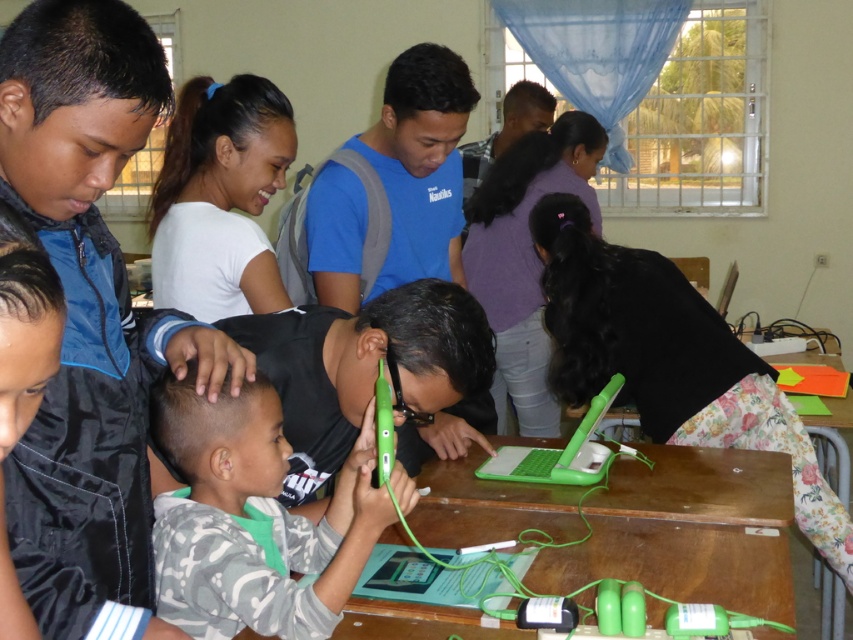
You are a student trying to place both the green matte tablet at center and the green plastic phone at center into your backpack. Which one should you place first to ensure both fit properly?

You should place the green matte tablet at center first because it is larger than the green plastic phone at center, allowing the smaller device to fit into the remaining space.

You are a teacher in the classroom and want to place both the green matte tablet at center and the green plastic laptop at center on a shelf that can only hold items where the taller one is placed first. Which device should you place first?

The green matte tablet at center is taller than the green plastic laptop at center, so you should place the green matte tablet at center first on the shelf.

You are standing in the classroom and see the point marked at coordinates (560, 451). Which object is this point located on?

The point at (560, 451) is located on the green plastic laptop at center.